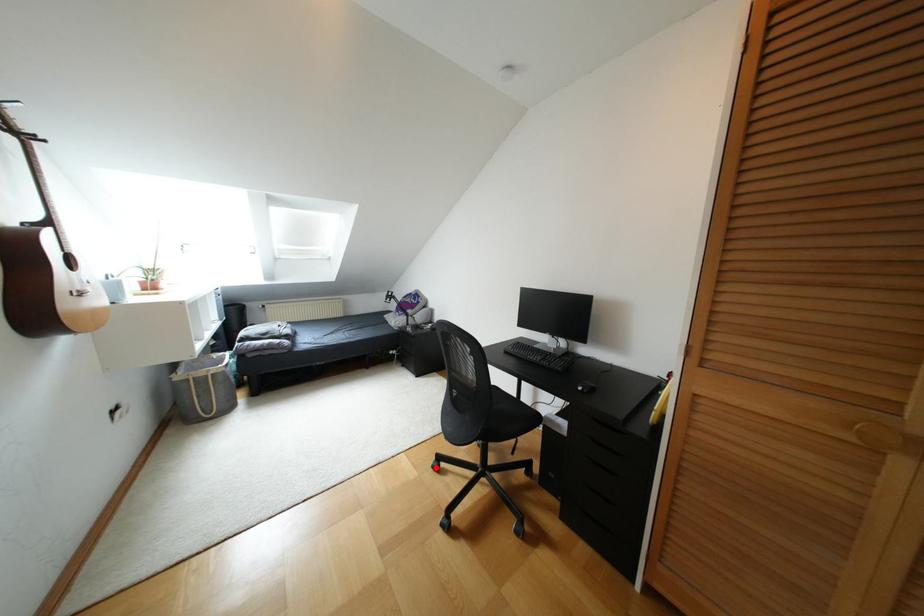
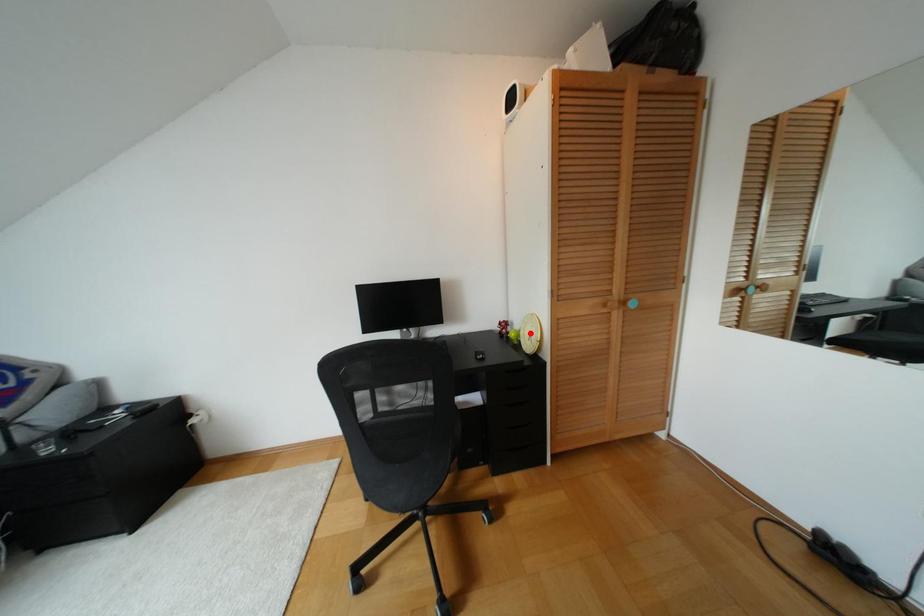
I am providing you with two images of the same scene from different viewpoints. A red point is marked on the first image and another point is marked on the second image. Do the highlighted points in image1 and image2 indicate the same real-world spot?

No